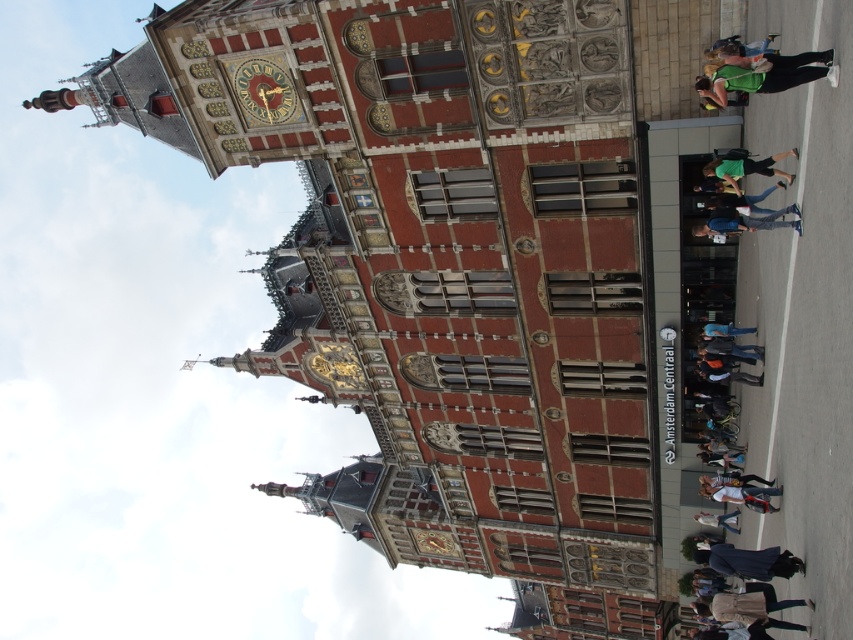
You are a photographer standing in front of the grand ornate building and want to take a photo that includes both the dark blue fabric coat at lower right and the white shirt at lower right. Which object should you ensure is positioned higher in the frame to include both in the photo?

The dark blue fabric coat at lower right is much taller than the white shirt at lower right, so you should position the camera to ensure the dark blue fabric coat at lower right is higher in the frame to include both objects in the photo.

You are standing in front of the grand ornate building and notice an object at the center. Where exactly is the blue denim jeans at center positioned in terms of coordinates?

The blue denim jeans at center is located at point coordinates of (746, 221).

You are a tailor who needs to determine the appropriate size for a customer. You observe the blue denim jeans at center and the white cotton shirt at lower right in the image. Which item has a greater width?

The blue denim jeans at center has a greater width than the white cotton shirt at lower right according to the description.